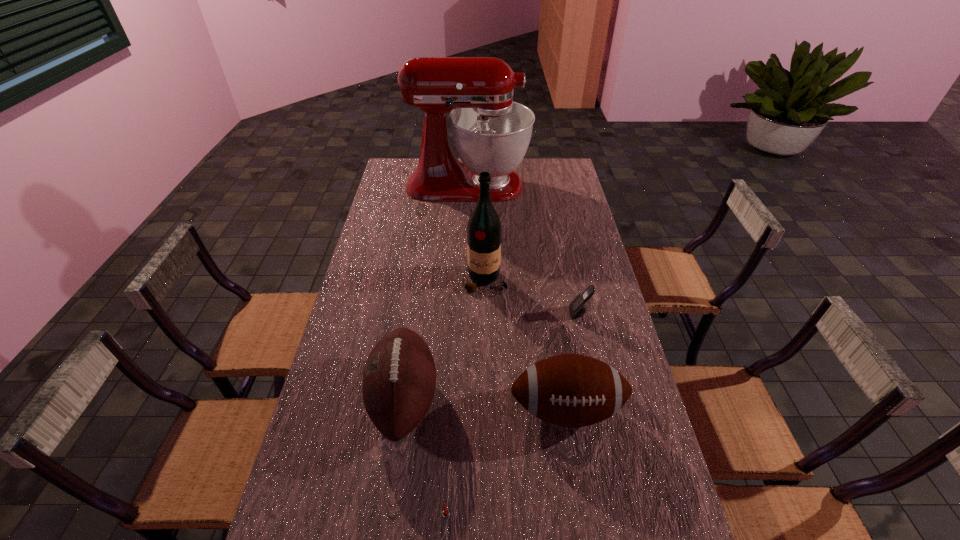
Identify the location of vacant area situated 0.100m on the front of the left football. (390, 501).

This screenshot has height=540, width=960. Identify the location of blank space located 0.050m on the laces of the right football. (575, 461).

Identify the location of vacant region located 0.080m on the front-facing side of the third farthest object. (545, 313).

Locate an element on the screen. Image resolution: width=960 pixels, height=540 pixels. vacant point located 0.330m on the front-facing side of the third farthest object is located at coordinates (x=470, y=313).

In order to click on vacant space situated on the front-facing side of the third farthest object in this screenshot , I will do (507, 313).

Locate an element on the screen. This screenshot has height=540, width=960. object at the far edge is located at coordinates (491, 133).

At what (x,y) coordinates should I click in order to perform the action: click on mixer that is at the left edge. Please return your answer as a coordinate pair (x, y). Looking at the image, I should click on (491, 133).

This screenshot has height=540, width=960. In order to click on football (American) that is positioned at the left edge in this screenshot , I will do `click(399, 378)`.

This screenshot has width=960, height=540. Find the location of `football positioned at the right edge`. football positioned at the right edge is located at coordinates (571, 390).

Locate an element on the screen. The width and height of the screenshot is (960, 540). cellular telephone that is at the right edge is located at coordinates (577, 308).